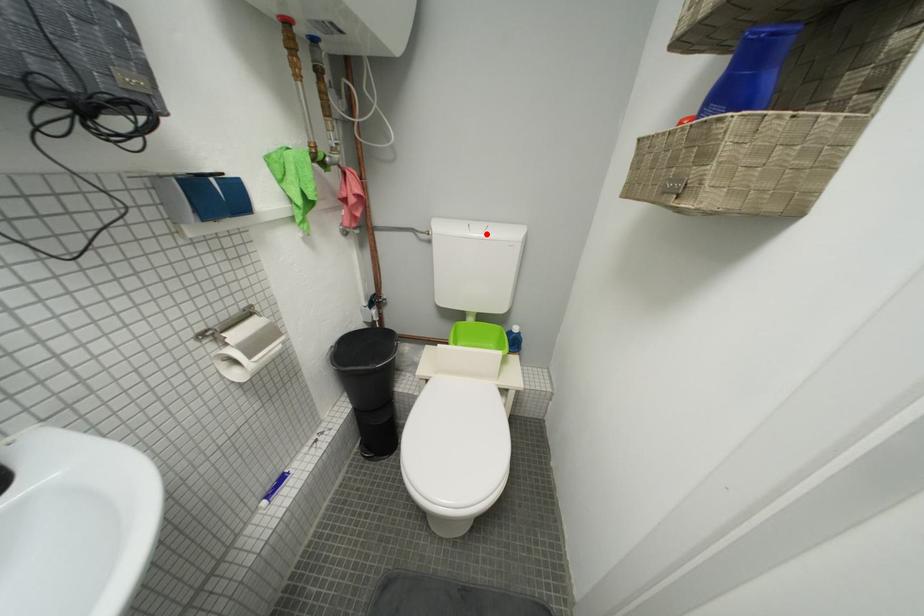
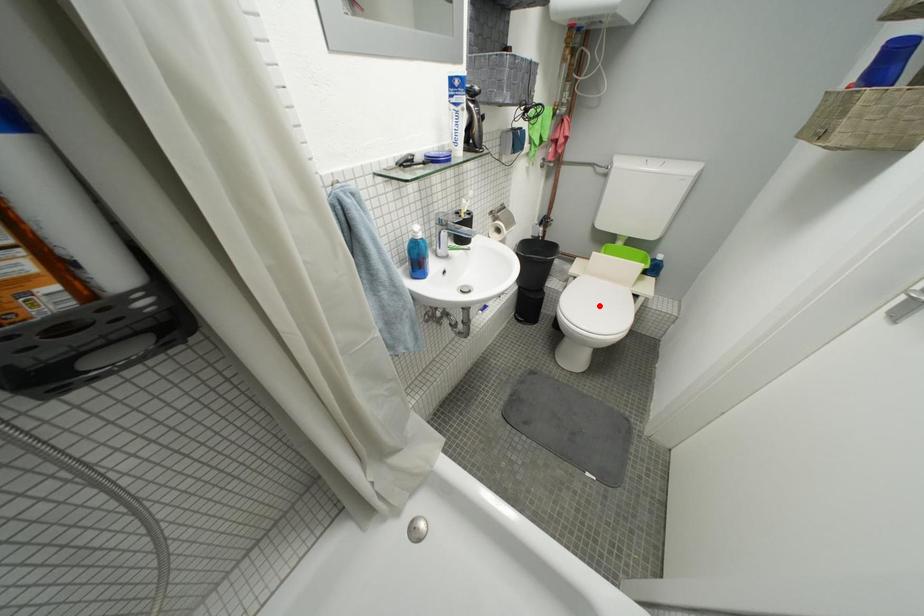
I am providing you with two images of the same scene from different viewpoints. A red point is marked on the first image and another point is marked on the second image. Is the marked point in image1 the same physical position as the marked point in image2?

No